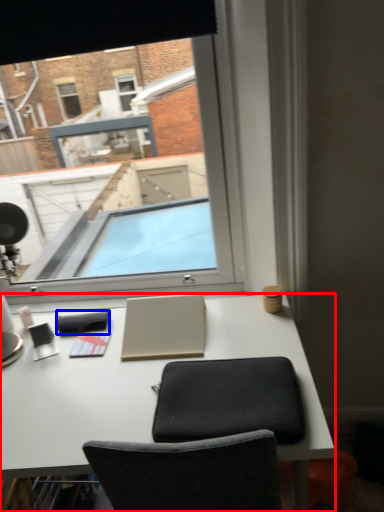
Question: Among these objects, which one is farthest to the camera, desk (highlighted by a red box) or notepad (highlighted by a blue box)?

Choices:
 (A) desk
 (B) notepad

Answer: (B)